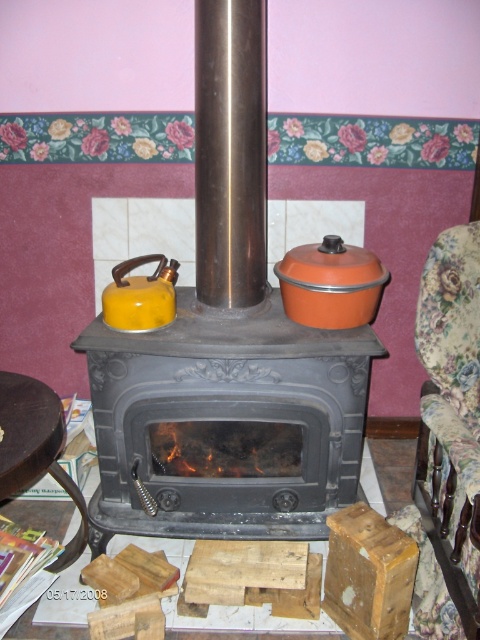
You have a yellow matte tea pot at center that you want to place on the counter next to the matte black stove at center. However, the counter space is only 1.2 meters wide. Can the tea pot fit next to the stove without overlapping?

The matte black stove at center might be wider than the yellow matte tea pot at center, so there is a possibility that the stove takes up more space, but without exact measurements, it is uncertain if the tea pot will fit. Check the actual width of both items before placing them.

In the scene shown: You are sitting in the floral fabric armchair at right and want to reach the yellow matte tea pot at center to pour yourself a cup of tea. Is the tea pot within your immediate reach without moving from your seat?

The floral fabric armchair at right is located below the yellow matte tea pot at center, so the tea pot is above your current position. You may need to stretch or adjust your seating to reach it comfortably.

You are standing in the room and want to place a new painting on the wall directly above the matte black stove at center. According to the coordinates provided, where should you position the painting?

The matte black stove at center is located at coordinates point (x=226, y=422), so you should position the painting directly above this point on the wall.